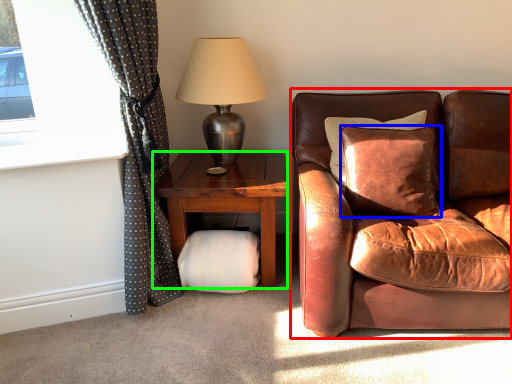
Question: Which object is the closest to the chair (highlighted by a red box)? Choose among these: pillow (highlighted by a blue box) or studio couch (highlighted by a green box).

Choices:
 (A) pillow
 (B) studio couch

Answer: (A)